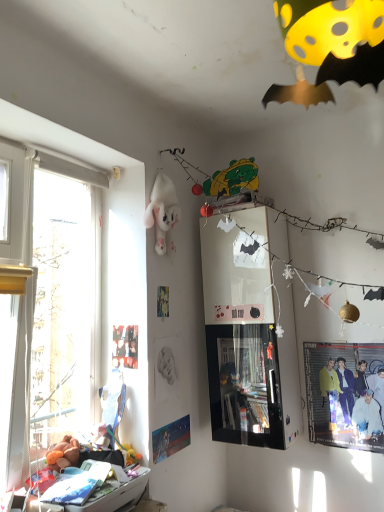
Question: Does white plastic drawer at lower left turn towards matte black poster at upper left, the first poster page from the left?

Choices:
 (A) yes
 (B) no

Answer: (B)

Question: From the image's perspective, is white plastic drawer at lower left below matte black poster at upper left, which is counted as the first poster page, starting from the top?

Choices:
 (A) no
 (B) yes

Answer: (B)

Question: Is white plastic drawer at lower left further to camera compared to matte black poster at upper left, the first poster page from the left?

Choices:
 (A) yes
 (B) no

Answer: (B)

Question: From a real-world perspective, is white plastic drawer at lower left located beneath matte black poster at upper left, the second poster page positioned from the right?

Choices:
 (A) no
 (B) yes

Answer: (B)

Question: Is the position of white plastic drawer at lower left less distant than that of matte black poster at upper left, the second poster page positioned from the right?

Choices:
 (A) yes
 (B) no

Answer: (A)

Question: Is white plastic drawer at lower left at the left side of matte black poster at upper left, the 2th poster page positioned from the bottom?

Choices:
 (A) yes
 (B) no

Answer: (A)

Question: Considering the relative sizes of white plush toy at upper center, marked as the 2th toy in a front-to-back arrangement, and matte yellow jacket at lower right in the image provided, is white plush toy at upper center, marked as the 2th toy in a front-to-back arrangement, shorter than matte yellow jacket at lower right?

Choices:
 (A) yes
 (B) no

Answer: (A)

Question: Is matte yellow jacket at lower right a part of white plush toy at upper center, marked as the 2th toy in a front-to-back arrangement?

Choices:
 (A) yes
 (B) no

Answer: (B)

Question: Can you confirm if white plush toy at upper center, the second toy when ordered from left to right, is positioned to the right of matte yellow jacket at lower right?

Choices:
 (A) yes
 (B) no

Answer: (B)

Question: Is white plush toy at upper center, which appears as the second toy when ordered from the bottom, outside matte yellow jacket at lower right?

Choices:
 (A) no
 (B) yes

Answer: (B)

Question: From the image's perspective, does white plush toy at upper center, which appears as the second toy when ordered from the bottom, appear lower than matte yellow jacket at lower right?

Choices:
 (A) yes
 (B) no

Answer: (B)

Question: Is matte black poster at upper left, which is counted as the first poster page, starting from the top, behind matte yellow jacket at lower right?

Choices:
 (A) no
 (B) yes

Answer: (A)